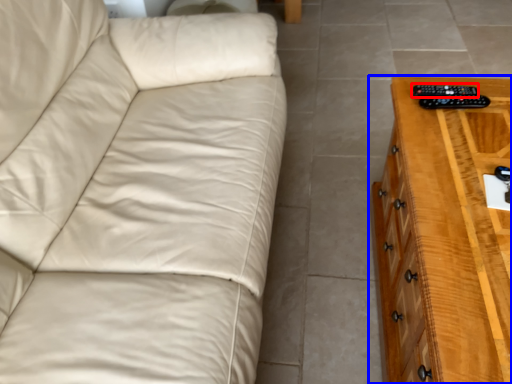
Question: Among these objects, which one is farthest to the camera, remote (highlighted by a red box) or chest of drawers (highlighted by a blue box)?

Choices:
 (A) remote
 (B) chest of drawers

Answer: (A)